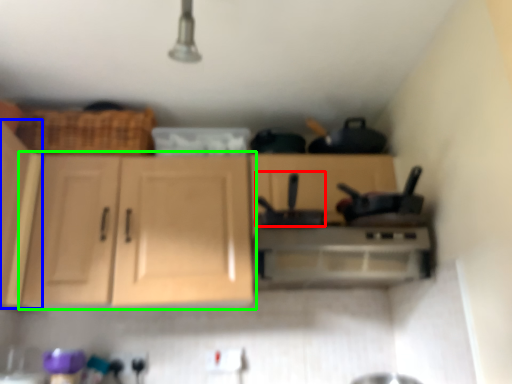
Question: Which object is the closest to the appliance (highlighted by a red box)? Choose among these: cabinetry (highlighted by a blue box) or cabinetry (highlighted by a green box).

Choices:
 (A) cabinetry
 (B) cabinetry

Answer: (B)